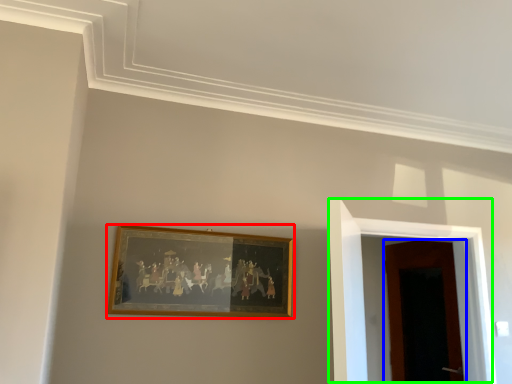
Question: Which is nearer to the picture frame (highlighted by a red box)? door (highlighted by a blue box) or door (highlighted by a green box).

Choices:
 (A) door
 (B) door

Answer: (B)